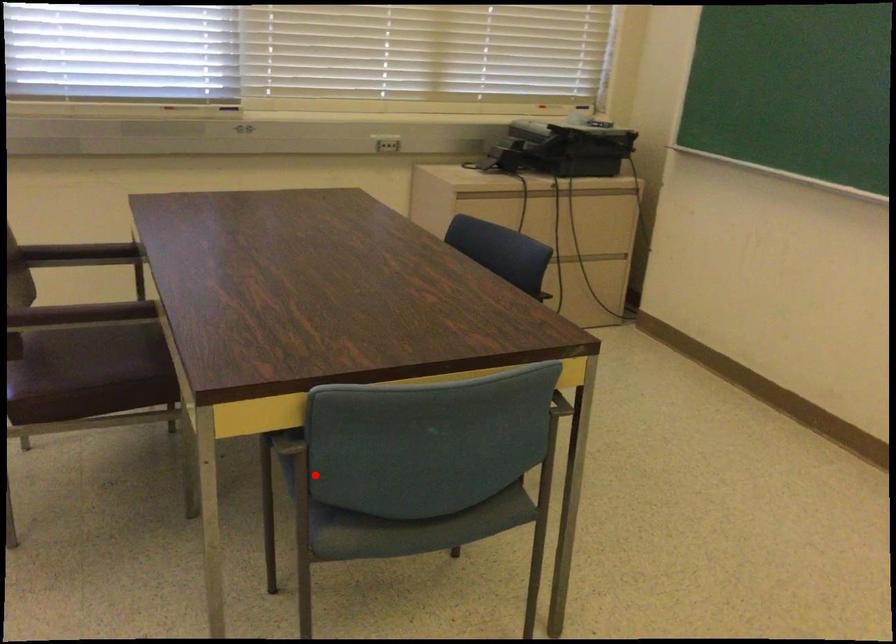
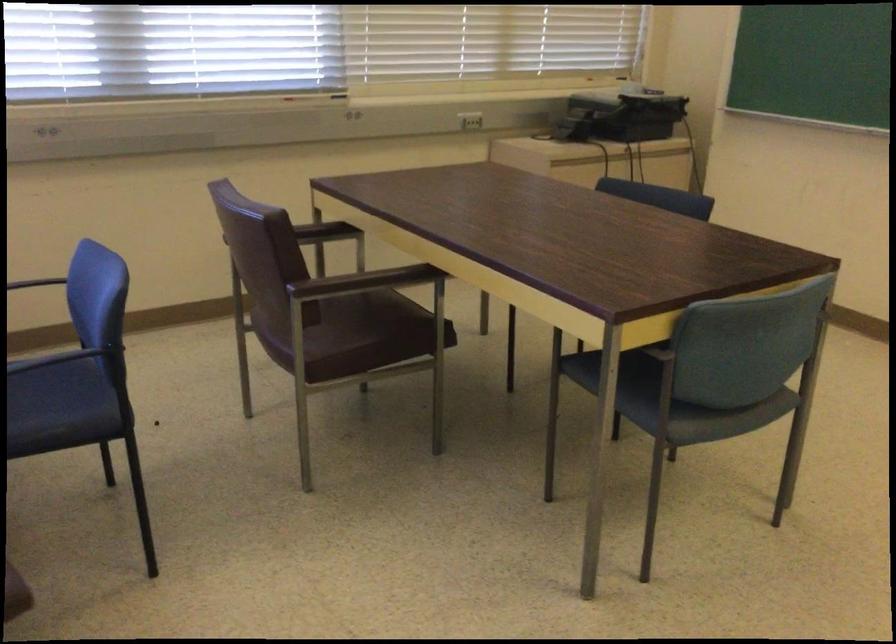
Find the pixel in the second image that matches the highlighted location in the first image.

(625, 384)